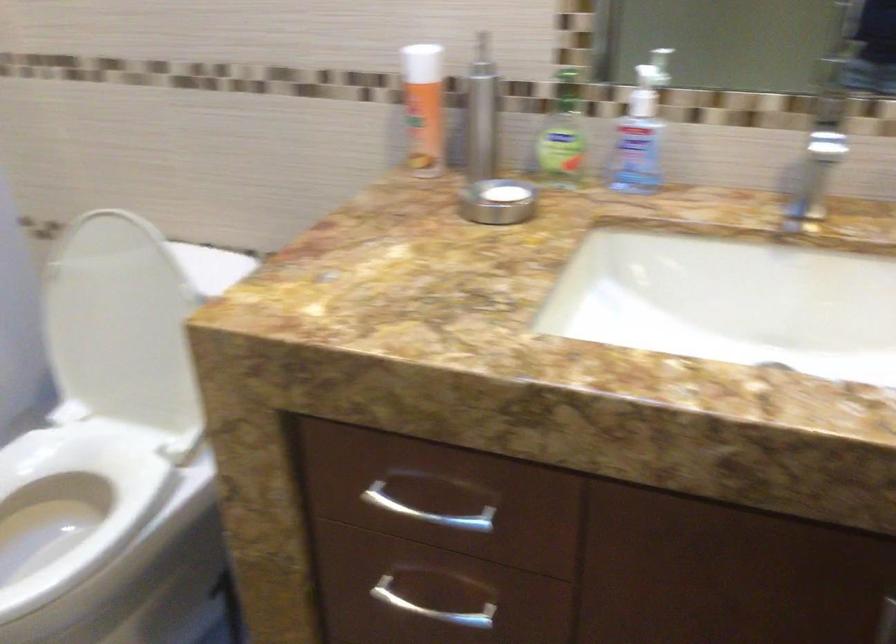
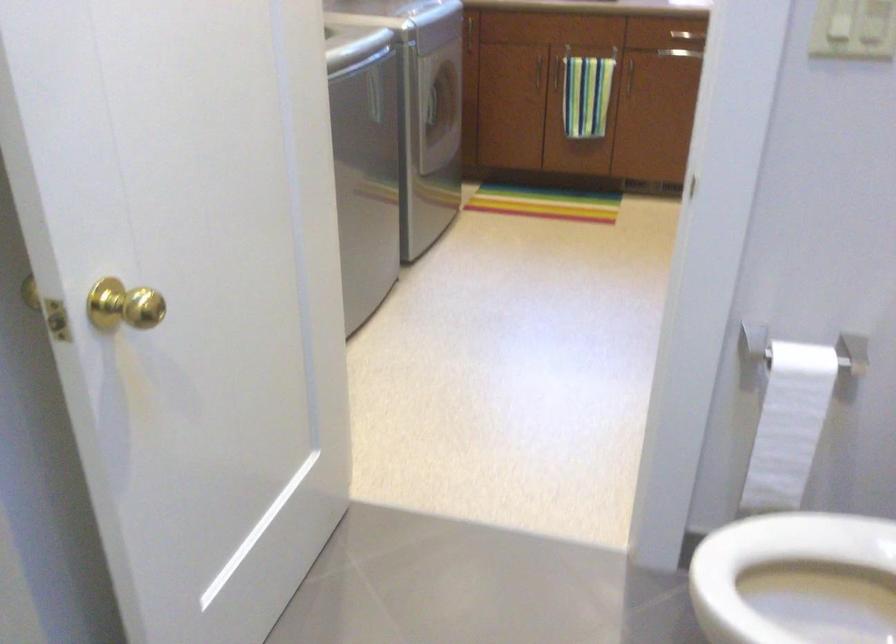
How did the camera likely rotate?

The camera rotated toward left-down.